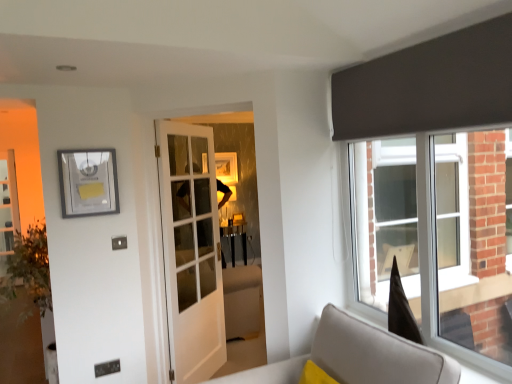
Question: Is matte silver picture frame at upper left to the left or to the right of white glass door at center in the image?

Choices:
 (A) left
 (B) right

Answer: (A)

Question: From a real-world perspective, is matte silver picture frame at upper left positioned above or below white glass door at center?

Choices:
 (A) below
 (B) above

Answer: (B)

Question: Based on their relative distances, which object is nearer to the matte silver picture frame at upper left?

Choices:
 (A) light gray fabric sofa at lower right
 (B) white glass door at center

Answer: (B)

Question: Estimate the real-world distances between objects in this image. Which object is closer to the matte silver picture frame at upper left?

Choices:
 (A) light gray fabric sofa at lower right
 (B) white glass door at center

Answer: (B)